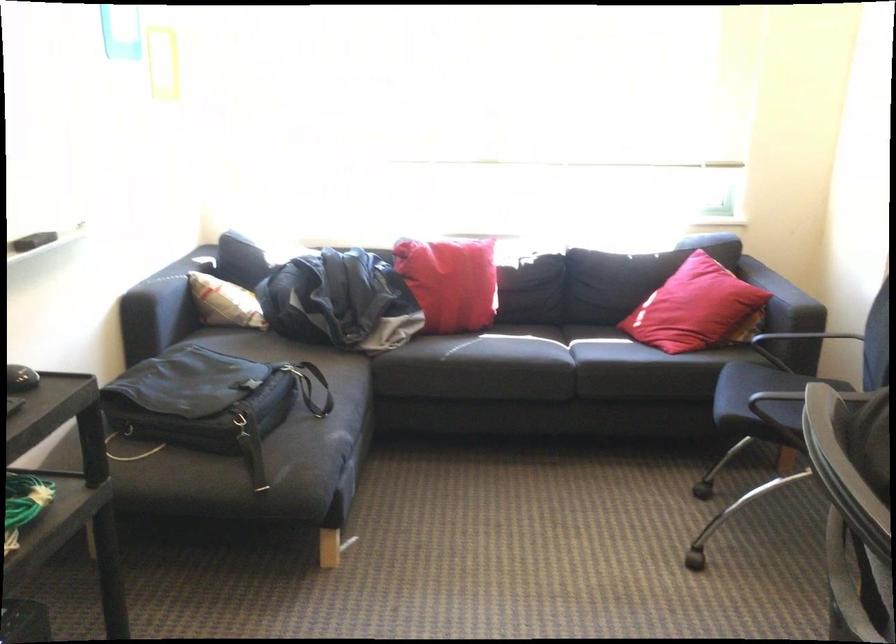
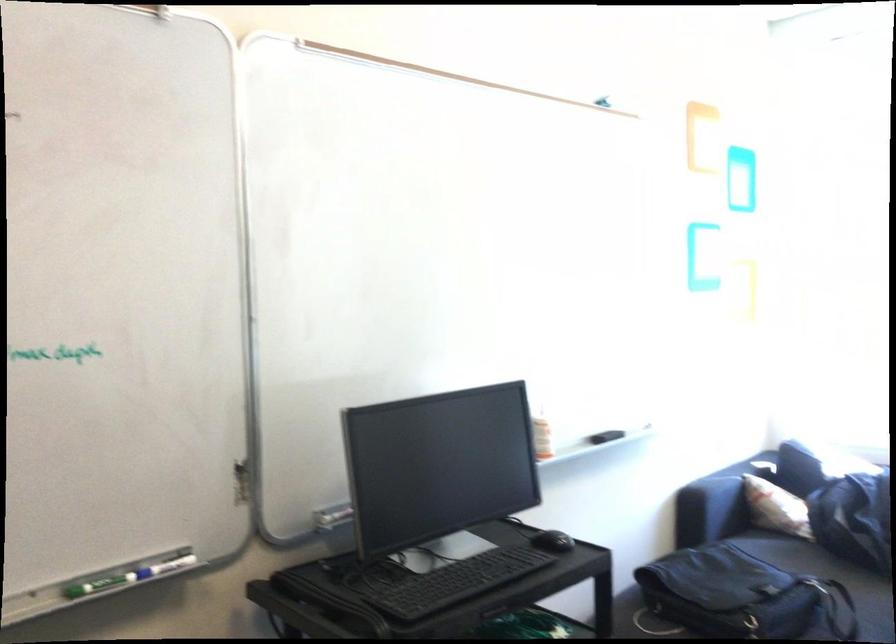
Locate, in the second image, the point that corresponds to [220,399] in the first image.

(744, 596)